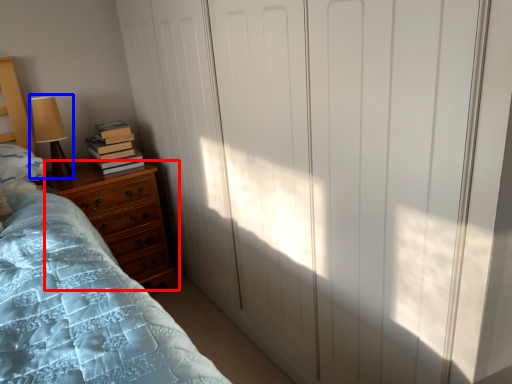
Question: Which of the following is the farthest to the observer, chest of drawers (highlighted by a red box) or table lamp (highlighted by a blue box)?

Choices:
 (A) chest of drawers
 (B) table lamp

Answer: (B)